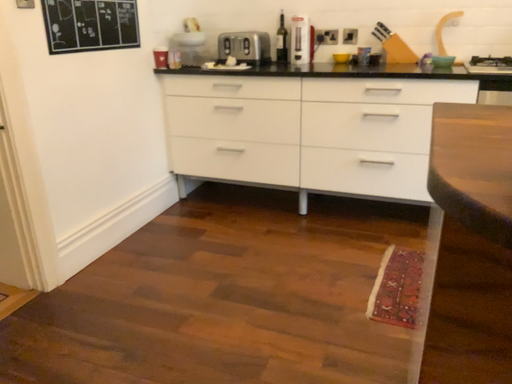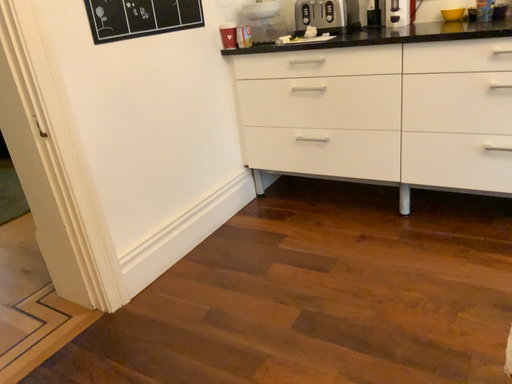
Question: Which way did the camera rotate in the video?

Choices:
 (A) rotated left
 (B) rotated right

Answer: (A)